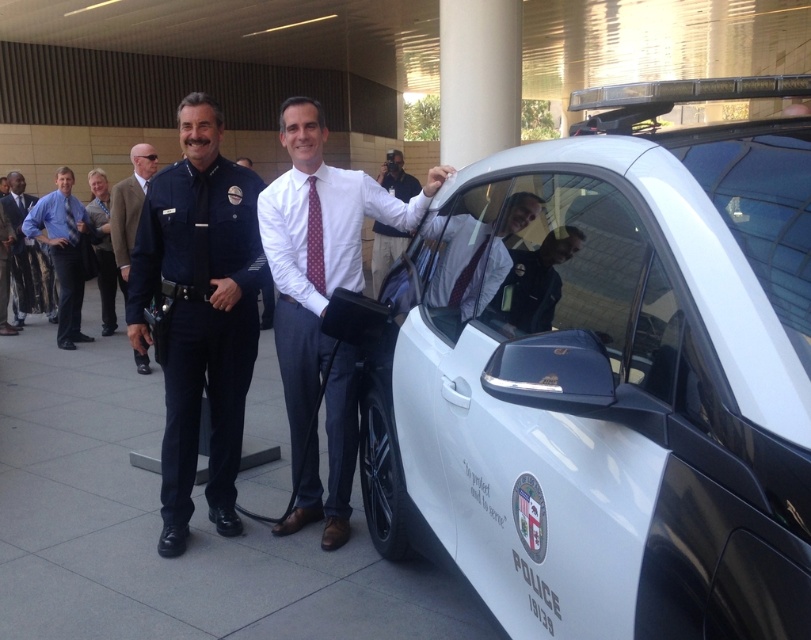
You are a tailor who needs to determine which garment requires more fabric to make between the light brown leather jacket at center and the dark gray suit at left. Based on the image, which one would need more fabric?

The light brown leather jacket at center is larger in size than the dark gray suit at left, so it would require more fabric to make.

You are a photographer at the scene and want to ensure both the blue shirt at left and the brown wool coat at left are visible in your photo. Which item should you focus on to capture both without cropping?

The blue shirt at left is positioned under the brown wool coat at left, so focusing on the brown wool coat at left would allow both to be visible as the shirt is beneath it.

You are a delivery person who needs to place a package between the brown wool coat at left and the light brown leather jacket at center. The package requires 4.8 feet of space. Is there enough space?

The brown wool coat at left is 5.15 feet from light brown leather jacket at center, so yes, there is enough space for the package since the distance is greater than the required 4.8 feet.